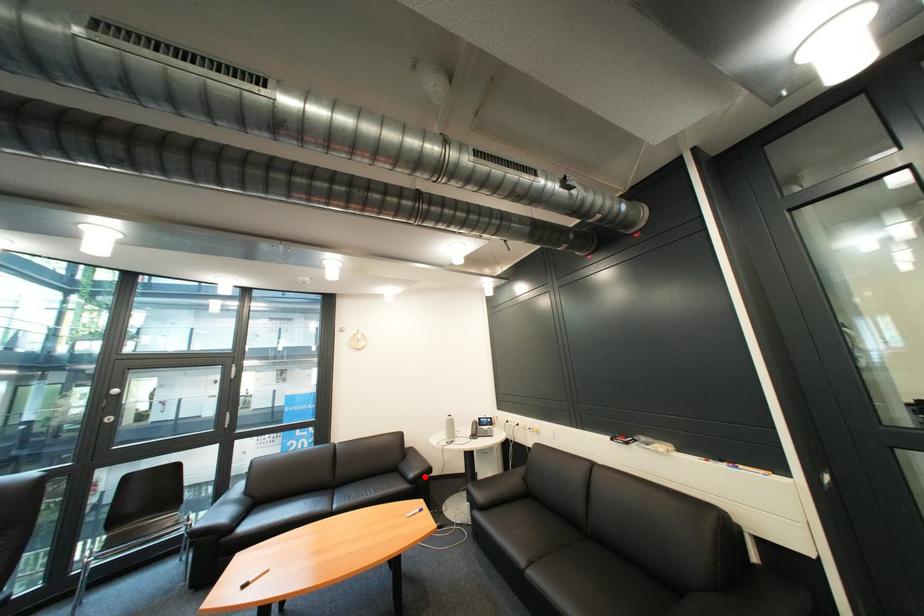
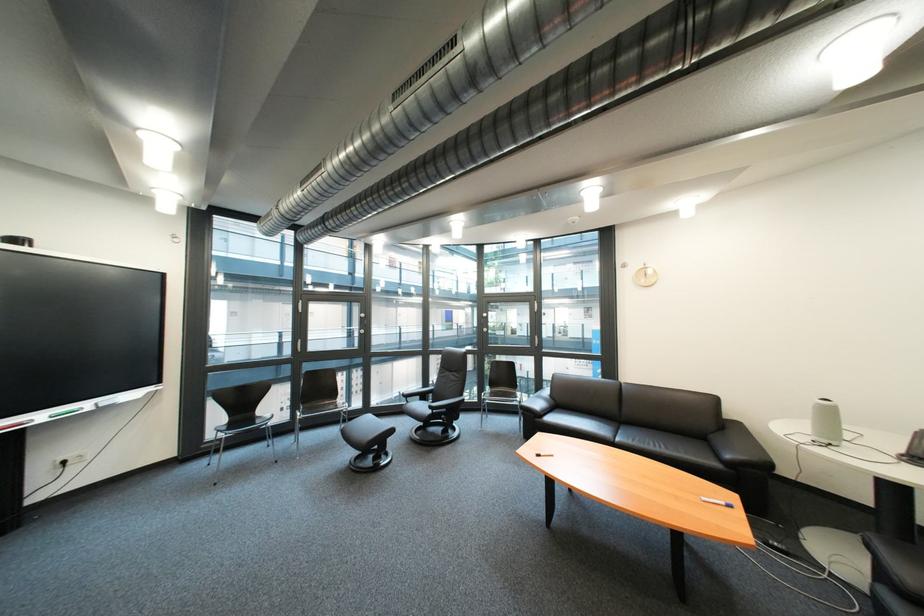
Question: I am providing you with two images of the same scene from different viewpoints. Image1 has a red point marked. In image2, the corresponding 3D location appears at what relative position? Reply with the corresponding letter.

Choices:
 (A) Closer
 (B) Farther

Answer: (A)